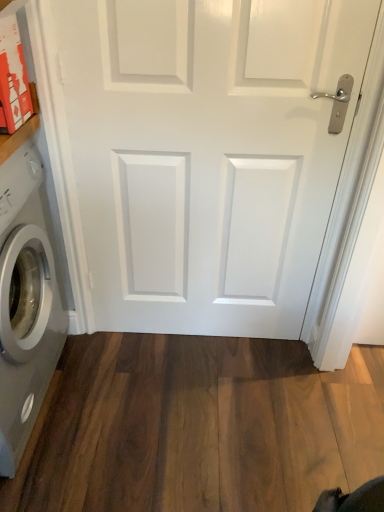
Locate an element on the screen. The image size is (384, 512). free space above brown wood flooring at lower center (from a real-world perspective) is located at coordinates (180, 410).